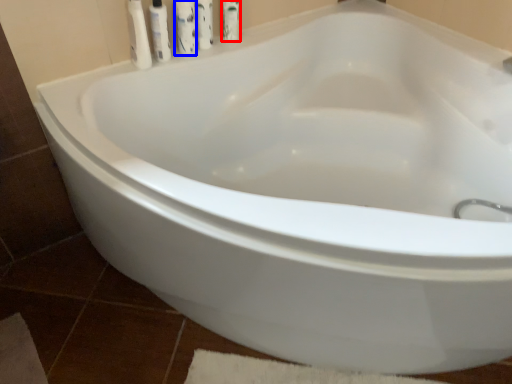
Question: Which object appears farthest to the camera in this image, mouthwash (highlighted by a red box) or cleaning product (highlighted by a blue box)?

Choices:
 (A) mouthwash
 (B) cleaning product

Answer: (A)